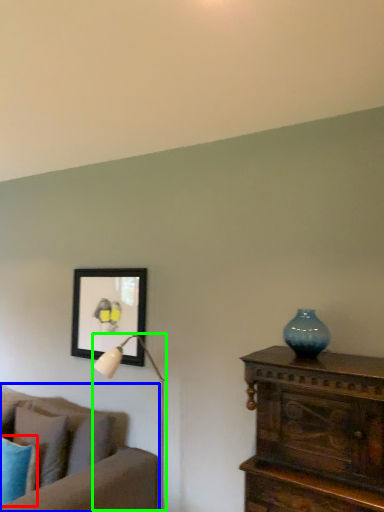
Question: Estimate the real-world distances between objects in this image. Which object is closer to pillow (highlighted by a red box), studio couch (highlighted by a blue box) or table lamp (highlighted by a green box)?

Choices:
 (A) studio couch
 (B) table lamp

Answer: (A)